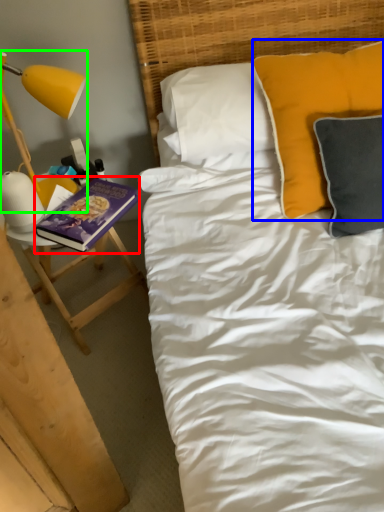
Question: Which object is positioned closest to paperback book (highlighted by a red box)? Select from pillow (highlighted by a blue box) and lamp (highlighted by a green box).

Choices:
 (A) pillow
 (B) lamp

Answer: (B)